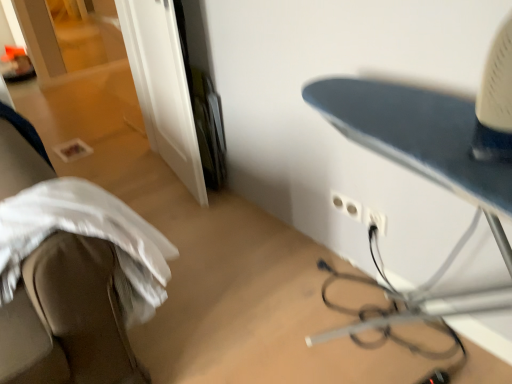
Describe the element at coordinates (375, 220) in the screenshot. I see `white plastic electric outlet at center-right, the 1th electric outlet positioned from the right` at that location.

Image resolution: width=512 pixels, height=384 pixels. Describe the element at coordinates (418, 137) in the screenshot. I see `blue metallic ironing board at right` at that location.

At what (x,y) coordinates should I click in order to perform the action: click on white plastic electric outlet at lower right, the second electric outlet viewed from the right. Please return your answer as a coordinate pair (x, y). This screenshot has height=384, width=512. Looking at the image, I should click on (346, 205).

Find the location of a particular element. white plastic electric outlet at center-right, the 1th electric outlet positioned from the right is located at coordinates (375, 220).

Between white plastic electric outlet at lower right, the 1th electric outlet viewed from the left, and white fabric at left, which one appears on the right side from the viewer's perspective?

From the viewer's perspective, white plastic electric outlet at lower right, the 1th electric outlet viewed from the left, appears more on the right side.

Looking at this image, is white fabric at left at the back of white plastic electric outlet at lower right, the second electric outlet viewed from the right?

white plastic electric outlet at lower right, the second electric outlet viewed from the right, does not have its back to white fabric at left.

Identify the location of the 1st electric outlet to the right of the white fabric at left, starting your count from the anchor. (346, 205).

Between point (354, 202) and point (8, 330), which one is positioned behind?

The point (354, 202) is more distant.

Relative to white fabric at left, is white plastic electric outlet at center-right, which ranks as the 2th electric outlet in left-to-right order, in front or behind?

In the image, white plastic electric outlet at center-right, which ranks as the 2th electric outlet in left-to-right order, appears behind white fabric at left.

Does white plastic electric outlet at center-right, the 1th electric outlet positioned from the right, appear on the right side of white fabric at left?

Indeed, white plastic electric outlet at center-right, the 1th electric outlet positioned from the right, is positioned on the right side of white fabric at left.

Choose the correct answer: Is white plastic electric outlet at center-right, the 1th electric outlet positioned from the right, inside white fabric at left or outside it?

white plastic electric outlet at center-right, the 1th electric outlet positioned from the right, is not inside white fabric at left, it's outside.

From a real-world perspective, is white plastic electric outlet at center-right, which ranks as the 2th electric outlet in left-to-right order, under white fabric at left?

Correct, in the physical world, white plastic electric outlet at center-right, which ranks as the 2th electric outlet in left-to-right order, is lower than white fabric at left.

Considering the points (93, 264) and (336, 209), which point is in front, point (93, 264) or point (336, 209)?

The point (93, 264) is in front.

From the image's perspective, which is above, white fabric at left or white plastic electric outlet at lower right, the 1th electric outlet viewed from the left?

white plastic electric outlet at lower right, the 1th electric outlet viewed from the left, appears higher in the image.

Can you confirm if white fabric at left is taller than white plastic electric outlet at lower right, the 1th electric outlet viewed from the left?

Correct, white fabric at left is much taller as white plastic electric outlet at lower right, the 1th electric outlet viewed from the left.

I want to click on furniture that appears on the left of white plastic electric outlet at lower right, the second electric outlet viewed from the right, so click(70, 271).

From a real-world perspective, count 2nd electric outlets downward from the blue metallic ironing board at right and point to it. Please provide its 2D coordinates.

[(346, 205)]

Which object is positioned more to the left, white plastic electric outlet at lower right, the second electric outlet viewed from the right, or blue metallic ironing board at right?

white plastic electric outlet at lower right, the second electric outlet viewed from the right.

Looking at this image, are white plastic electric outlet at lower right, the second electric outlet viewed from the right, and blue metallic ironing board at right making contact?

They are not placed beside each other.

Is white plastic electric outlet at lower right, the 1th electric outlet viewed from the left, positioned beyond the bounds of blue metallic ironing board at right?

Yes.

Does blue metallic ironing board at right have a lesser width compared to white plastic electric outlet at center-right, which ranks as the 2th electric outlet in left-to-right order?

In fact, blue metallic ironing board at right might be wider than white plastic electric outlet at center-right, which ranks as the 2th electric outlet in left-to-right order.

From the image's perspective, is blue metallic ironing board at right above or below white plastic electric outlet at center-right, the 1th electric outlet positioned from the right?

blue metallic ironing board at right is below white plastic electric outlet at center-right, the 1th electric outlet positioned from the right.

Considering the sizes of objects blue metallic ironing board at right and white plastic electric outlet at center-right, which ranks as the 2th electric outlet in left-to-right order, in the image provided, who is smaller, blue metallic ironing board at right or white plastic electric outlet at center-right, which ranks as the 2th electric outlet in left-to-right order,?

Smaller between the two is white plastic electric outlet at center-right, which ranks as the 2th electric outlet in left-to-right order.

Can you confirm if white plastic electric outlet at lower right, the second electric outlet viewed from the right, is positioned to the right of white plastic electric outlet at center-right, the 1th electric outlet positioned from the right?

No, white plastic electric outlet at lower right, the second electric outlet viewed from the right, is not to the right of white plastic electric outlet at center-right, the 1th electric outlet positioned from the right.

Is white plastic electric outlet at center-right, the 1th electric outlet positioned from the right, surrounded by white plastic electric outlet at lower right, the 1th electric outlet viewed from the left?

That's incorrect, white plastic electric outlet at center-right, the 1th electric outlet positioned from the right, is not inside white plastic electric outlet at lower right, the 1th electric outlet viewed from the left.

From a real-world perspective, who is located lower, white plastic electric outlet at lower right, the 1th electric outlet viewed from the left, or white plastic electric outlet at center-right, the 1th electric outlet positioned from the right?

white plastic electric outlet at lower right, the 1th electric outlet viewed from the left.

This screenshot has width=512, height=384. I want to click on furniture beneath the blue metallic ironing board at right (from a real-world perspective), so click(x=70, y=271).

From a real-world perspective, is blue metallic ironing board at right physically located above or below white fabric at left?

blue metallic ironing board at right is above white fabric at left.

Looking at their sizes, would you say blue metallic ironing board at right is wider or thinner than white fabric at left?

Clearly, blue metallic ironing board at right has more width compared to white fabric at left.

Who is shorter, blue metallic ironing board at right or white fabric at left?

With less height is white fabric at left.

Locate an element on the screen. The height and width of the screenshot is (384, 512). furniture above the white plastic electric outlet at lower right, the second electric outlet viewed from the right (from a real-world perspective) is located at coordinates (70, 271).

From the image's perspective, count 1st electric outlets upward from the white fabric at left and point to it. Please provide its 2D coordinates.

[(375, 220)]

Which object lies nearer to the anchor point white fabric at left, white plastic electric outlet at center-right, the 1th electric outlet positioned from the right, or white plastic electric outlet at lower right, the 1th electric outlet viewed from the left?

Among the two, white plastic electric outlet at lower right, the 1th electric outlet viewed from the left, is located nearer to white fabric at left.

Considering their positions, is white fabric at left positioned closer to white plastic electric outlet at lower right, the 1th electric outlet viewed from the left, than blue metallic ironing board at right?

blue metallic ironing board at right is positioned closer to the anchor white plastic electric outlet at lower right, the 1th electric outlet viewed from the left.

When comparing their distances from white fabric at left, does white plastic electric outlet at lower right, the second electric outlet viewed from the right, or blue metallic ironing board at right seem further?

Among the two, white plastic electric outlet at lower right, the second electric outlet viewed from the right, is located further to white fabric at left.

Considering their positions, is white plastic electric outlet at center-right, which ranks as the 2th electric outlet in left-to-right order, positioned closer to blue metallic ironing board at right than white plastic electric outlet at lower right, the second electric outlet viewed from the right?

white plastic electric outlet at center-right, which ranks as the 2th electric outlet in left-to-right order, is closer to blue metallic ironing board at right.

Based on their spatial positions, is white plastic electric outlet at center-right, which ranks as the 2th electric outlet in left-to-right order, or blue metallic ironing board at right further from white fabric at left?

Based on the image, white plastic electric outlet at center-right, which ranks as the 2th electric outlet in left-to-right order, appears to be further to white fabric at left.

Based on their spatial positions, is white fabric at left or white plastic electric outlet at lower right, the second electric outlet viewed from the right, further from white plastic electric outlet at center-right, which ranks as the 2th electric outlet in left-to-right order?

Based on the image, white fabric at left appears to be further to white plastic electric outlet at center-right, which ranks as the 2th electric outlet in left-to-right order.

Looking at the image, which one is located further to blue metallic ironing board at right, white plastic electric outlet at lower right, the 1th electric outlet viewed from the left, or white fabric at left?

The object further to blue metallic ironing board at right is white fabric at left.

Estimate the real-world distances between objects in this image. Which object is further from white fabric at left, white plastic electric outlet at lower right, the second electric outlet viewed from the right, or white plastic electric outlet at center-right, the 1th electric outlet positioned from the right?

white plastic electric outlet at center-right, the 1th electric outlet positioned from the right, is further to white fabric at left.

At what (x,y) coordinates should I click in order to perform the action: click on electric outlet between white fabric at left and blue metallic ironing board at right in the horizontal direction. Please return your answer as a coordinate pair (x, y). Looking at the image, I should click on (346, 205).

In order to click on table between white fabric at left and white plastic electric outlet at center-right, which ranks as the 2th electric outlet in left-to-right order, in the horizontal direction in this screenshot , I will do `click(418, 137)`.

What are the coordinates of `electric outlet between white fabric at left and white plastic electric outlet at center-right, which ranks as the 2th electric outlet in left-to-right order` in the screenshot? It's located at (346, 205).

I want to click on electric outlet between blue metallic ironing board at right and white plastic electric outlet at lower right, the second electric outlet viewed from the right, from front to back, so click(375, 220).